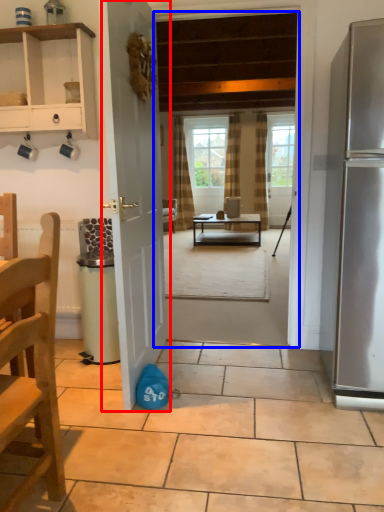
Question: Among these objects, which one is nearest to the camera, door (highlighted by a red box) or terrace (highlighted by a blue box)?

Choices:
 (A) door
 (B) terrace

Answer: (A)